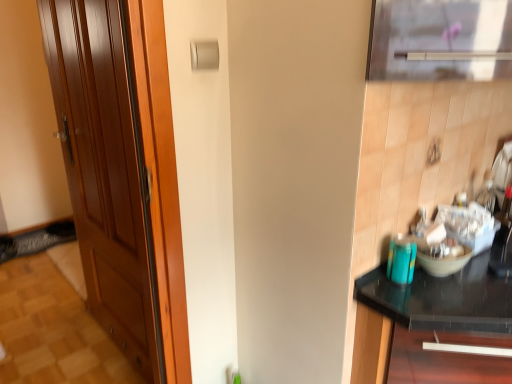
Question: From their relative heights in the image, would you say shiny brown door at left is taller or shorter than black glass countertop at right?

Choices:
 (A) short
 (B) tall

Answer: (B)

Question: Is shiny brown door at left inside or outside of black glass countertop at right?

Choices:
 (A) outside
 (B) inside

Answer: (A)

Question: Does point (123, 170) appear closer or farther from the camera than point (504, 332)?

Choices:
 (A) closer
 (B) farther

Answer: (B)

Question: Considering the positions of black glass countertop at right and shiny brown door at left in the image, is black glass countertop at right wider or thinner than shiny brown door at left?

Choices:
 (A) thin
 (B) wide

Answer: (B)

Question: Visually, is black glass countertop at right positioned to the left or to the right of shiny brown door at left?

Choices:
 (A) left
 (B) right

Answer: (B)

Question: Considering the positions of point [x=458, y=281] and point [x=141, y=233], is point [x=458, y=281] closer or farther from the camera than point [x=141, y=233]?

Choices:
 (A) closer
 (B) farther

Answer: (A)

Question: From the image's perspective, is black glass countertop at right above or below shiny brown door at left?

Choices:
 (A) above
 (B) below

Answer: (B)